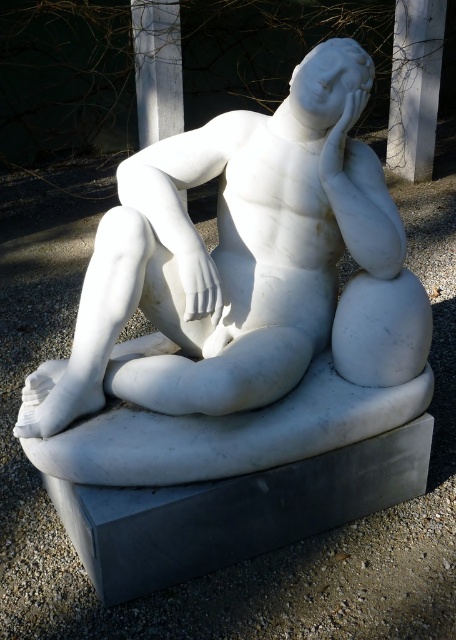
You are an art conservator tasked with moving the white marble statue at center to a new location. The statue weighs 200 kg and requires a minimum of 4 meters of clearance from any nearby structures to avoid damage. Based on the scene, will the statue be able to be moved safely without hitting the white marble pillar at upper center?

The white marble statue at center is 3.76 meters away from the white marble pillar at upper center. Since the required clearance is 4 meters, the distance is insufficient. Moving the statue could result in collision with the pillar, so it cannot be moved safely.

You are an art conservator assessing the placement of the white marble statue at center and the white marble pillar at upper center. Based on their heights, which one might require a higher platform to ensure they are at the same level?

The white marble statue at center has a lesser height compared to the white marble pillar at upper center, so the statue would need a higher platform to match the pillar.

You are an art student analyzing the composition of the sculpture. Based on the scene, where is the white marble statue at center in relation to the white marble pillar at upper center?

The white marble statue at center is positioned below the white marble pillar at upper center.